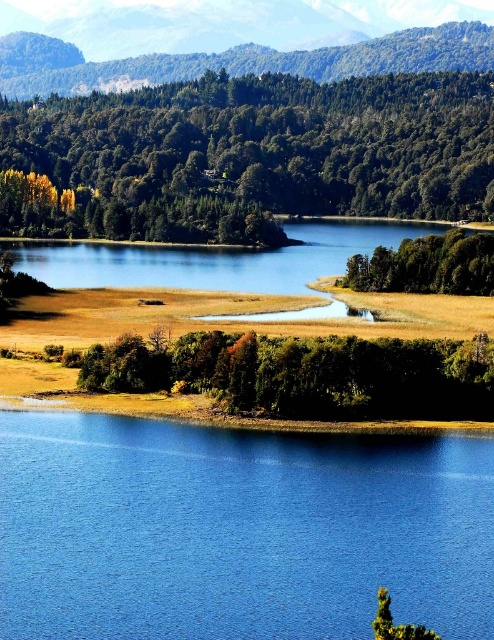
In the scene shown: You are standing on the lakeshore and see the blue smooth water at lower center and the green leafy trees at center. Which object is closer to your feet?

The blue smooth water at lower center is closer to your feet since it is located below the green leafy trees at center.

You are standing on the lakeshore and see the blue smooth water at lower center and the green leafy trees at center. Which object appears taller from your viewpoint?

The green leafy trees at center appear taller than the blue smooth water at lower center because the description states that the blue smooth water at lower center has a lesser height compared to the green leafy trees at center.